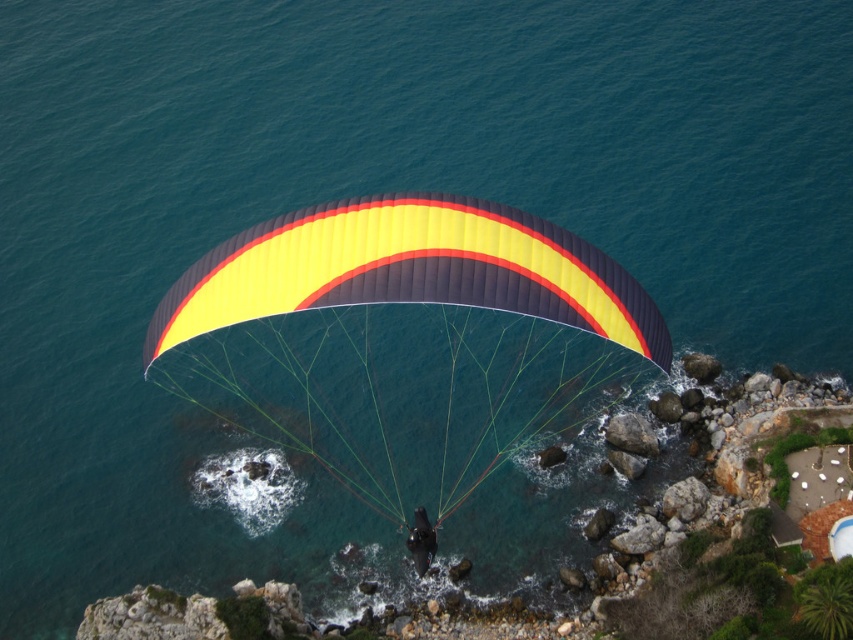
You are a photographer capturing the paraglider scene. You notice the yellow matte parachute at center and the matte black helmet at center. Which object is positioned in front of the other in the image?

The yellow matte parachute at center is closer to the viewer than the matte black helmet at center, so it is positioned in front of the matte black helmet at center.

You are a photographer trying to capture the paraglider and its equipment. You notice the yellow matte parachute at center and the matte black helmet at center. Which object should you zoom in on if you want to focus on the wider object?

The yellow matte parachute at center is wider than the matte black helmet at center, so you should zoom in on the yellow matte parachute at center to focus on the wider object.

You are a photographer aiming to capture the paraglider from below. You notice the yellow matte parachute at center and the matte black helmet at center. Which object should appear higher in your photo?

The yellow matte parachute at center is positioned over the matte black helmet at center, so it will appear higher in the photo.